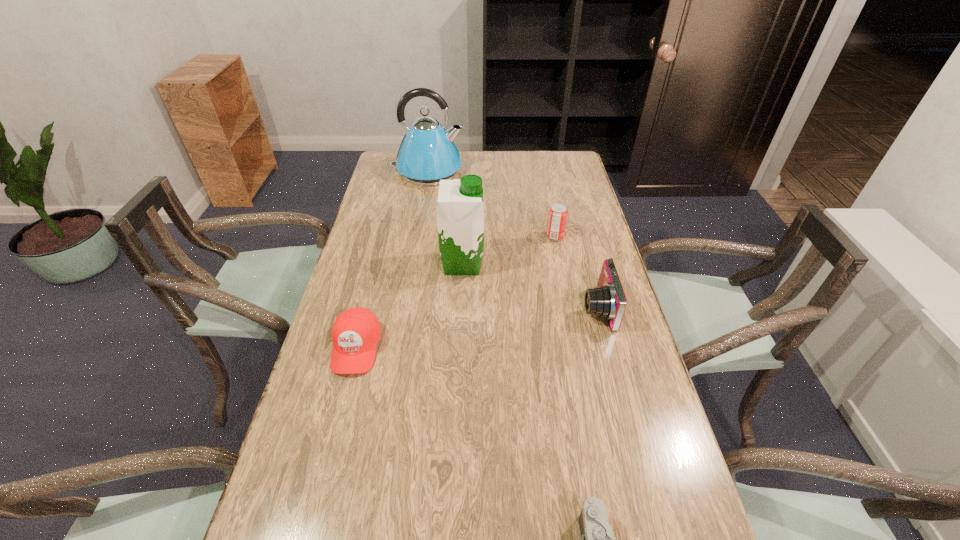
Where is `vacant space located 0.220m on the front-facing side of the right camera`? vacant space located 0.220m on the front-facing side of the right camera is located at coordinates (503, 308).

At what (x,y) coordinates should I click in order to perform the action: click on free space located on the front-facing side of the right camera. Please return your answer as a coordinate pair (x, y). This screenshot has height=540, width=960. Looking at the image, I should click on (557, 308).

At what (x,y) coordinates should I click in order to perform the action: click on vacant space located 0.180m on the front panel of the second shortest object. Please return your answer as a coordinate pair (x, y). The height and width of the screenshot is (540, 960). Looking at the image, I should click on (330, 449).

Identify the location of object that is at the far edge. The height and width of the screenshot is (540, 960). (427, 154).

Where is `kettle that is positioned at the left edge`? This screenshot has width=960, height=540. kettle that is positioned at the left edge is located at coordinates [x=427, y=154].

This screenshot has height=540, width=960. I want to click on baseball cap located at the left edge, so tap(356, 331).

The width and height of the screenshot is (960, 540). Identify the location of soda can at the right edge. (557, 218).

The height and width of the screenshot is (540, 960). I want to click on camera positioned at the right edge, so [607, 300].

What are the coordinates of `object present at the far left corner` in the screenshot? It's located at (x=427, y=154).

The width and height of the screenshot is (960, 540). In order to click on free space at the left edge of the desktop in this screenshot , I will do `click(365, 403)`.